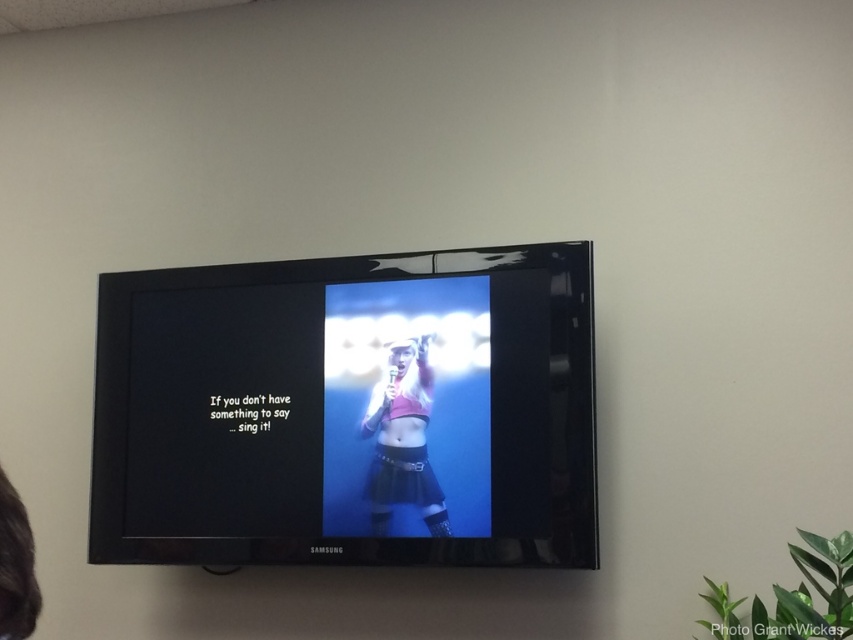
Question: Which of the following is the farthest from the observer?

Choices:
 (A) matte black tv at center
 (B) matte pink top at center

Answer: (B)

Question: Is the position of matte black tv at center more distant than that of matte pink top at center?

Choices:
 (A) yes
 (B) no

Answer: (B)

Question: Is matte black tv at center closer to the viewer compared to matte pink top at center?

Choices:
 (A) no
 (B) yes

Answer: (B)

Question: Is matte black tv at center to the right of matte pink top at center from the viewer's perspective?

Choices:
 (A) yes
 (B) no

Answer: (B)

Question: Which point is farther to the camera?

Choices:
 (A) (171, 356)
 (B) (434, 509)

Answer: (A)